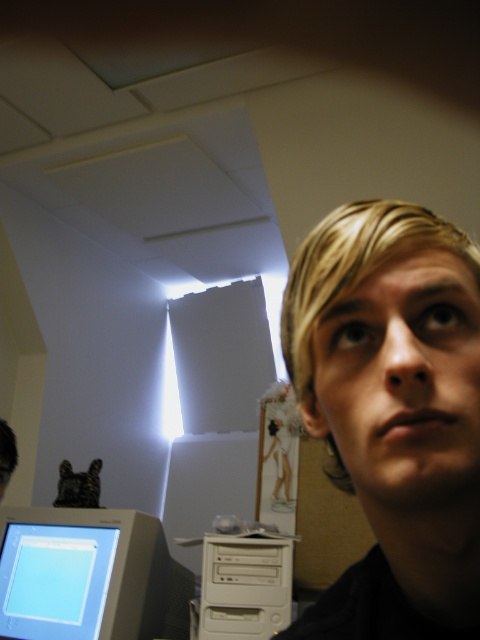
Question: Which of the following is the farthest from the observer?

Choices:
 (A) beige plastic monitor at bottom left
 (B) blonde hair at right

Answer: (A)

Question: Which of the following is the closest to the observer?

Choices:
 (A) white plastic computer at center
 (B) beige plastic monitor at bottom left
 (C) blonde hair at right

Answer: (C)

Question: Is blonde hair at right further to the viewer compared to white plastic computer at center?

Choices:
 (A) no
 (B) yes

Answer: (A)

Question: Which point is closer to the camera taking this photo?

Choices:
 (A) (361, 340)
 (B) (247, 556)
 (C) (135, 541)

Answer: (A)

Question: Is beige plastic monitor at bottom left further to the viewer compared to white plastic computer at center?

Choices:
 (A) no
 (B) yes

Answer: (A)

Question: Can you confirm if beige plastic monitor at bottom left is positioned below white plastic computer at center?

Choices:
 (A) no
 (B) yes

Answer: (A)